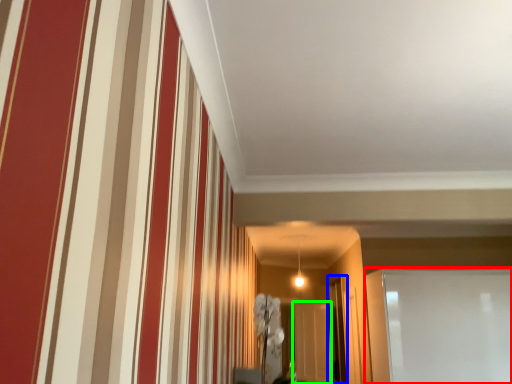
Question: Based on their relative distances, which object is farther from glass door (highlighted by a red box)? Choose from glass door (highlighted by a blue box) and glass door (highlighted by a green box).

Choices:
 (A) glass door
 (B) glass door

Answer: (B)